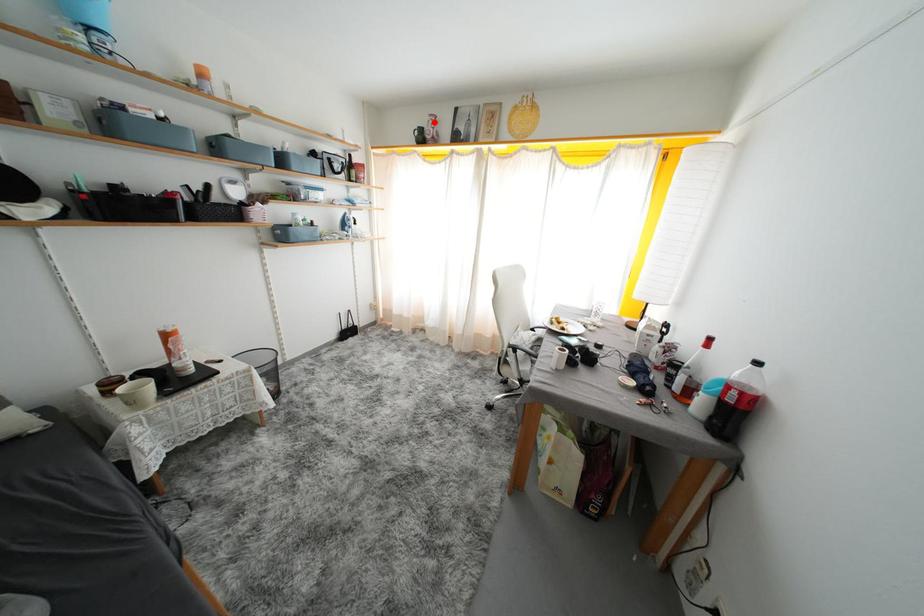
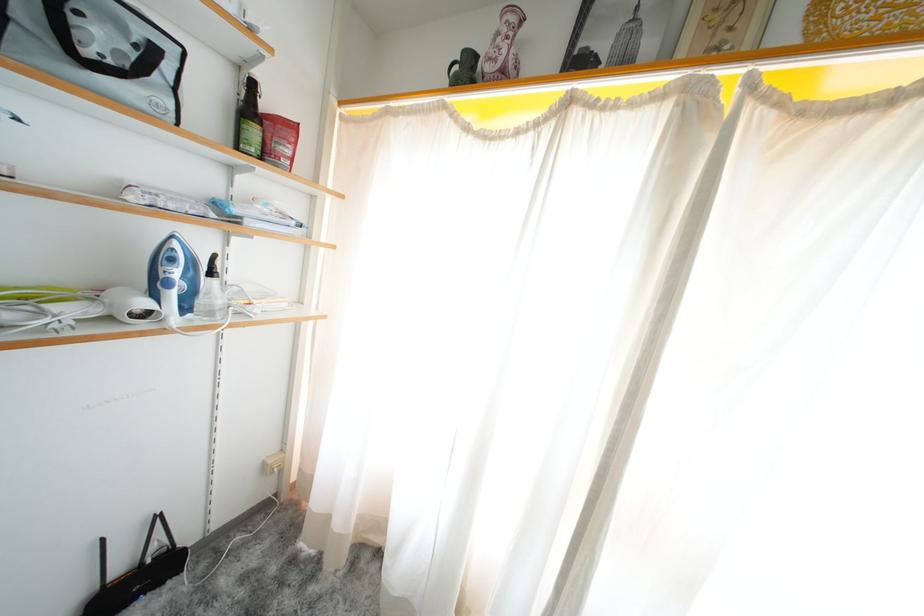
Question: I am providing you with two images of the same scene from different viewpoints. A red point is marked on the first image. Is the red point's position out of view in image 2?

Choices:
 (A) Yes
 (B) No

Answer: (B)